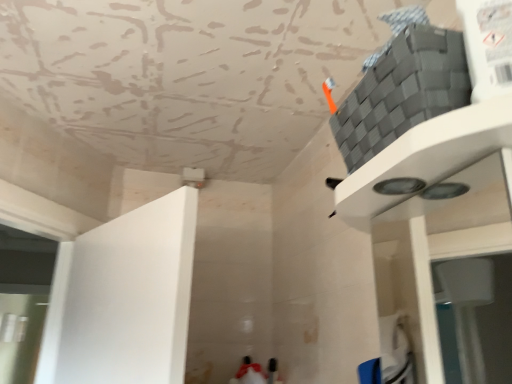
The image size is (512, 384). Describe the element at coordinates (402, 92) in the screenshot. I see `gray woven basket at upper right` at that location.

Image resolution: width=512 pixels, height=384 pixels. What are the coordinates of `gray woven basket at upper right` in the screenshot? It's located at (402, 92).

I want to click on gray woven basket at upper right, so click(402, 92).